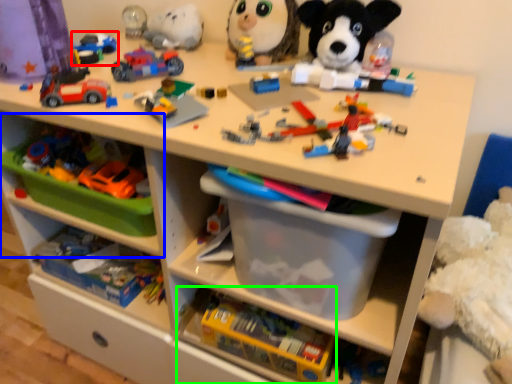
Question: Which object is positioned farthest from toy (highlighted by a red box)? Select from shelf (highlighted by a blue box) and toy (highlighted by a green box).

Choices:
 (A) shelf
 (B) toy

Answer: (B)